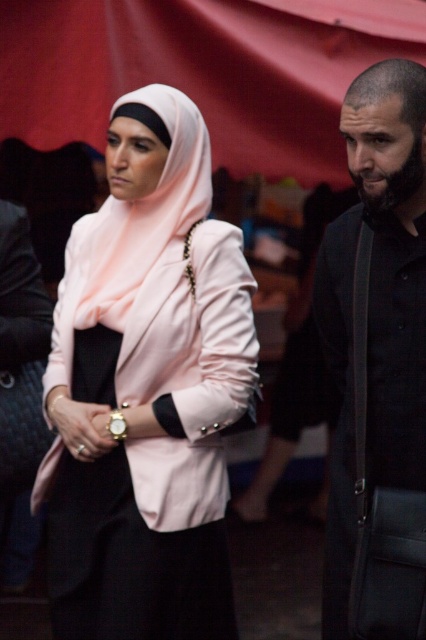
Can you confirm if matte pink blazer at center is bigger than black matte shirt at right?

Indeed, matte pink blazer at center has a larger size compared to black matte shirt at right.

Which is above, matte pink blazer at center or black matte shirt at right?

black matte shirt at right is above.

Is point (152, 128) farther from camera compared to point (408, 627)?

Yes, point (152, 128) is behind point (408, 627).

This screenshot has height=640, width=426. I want to click on matte pink blazer at center, so click(x=146, y=388).